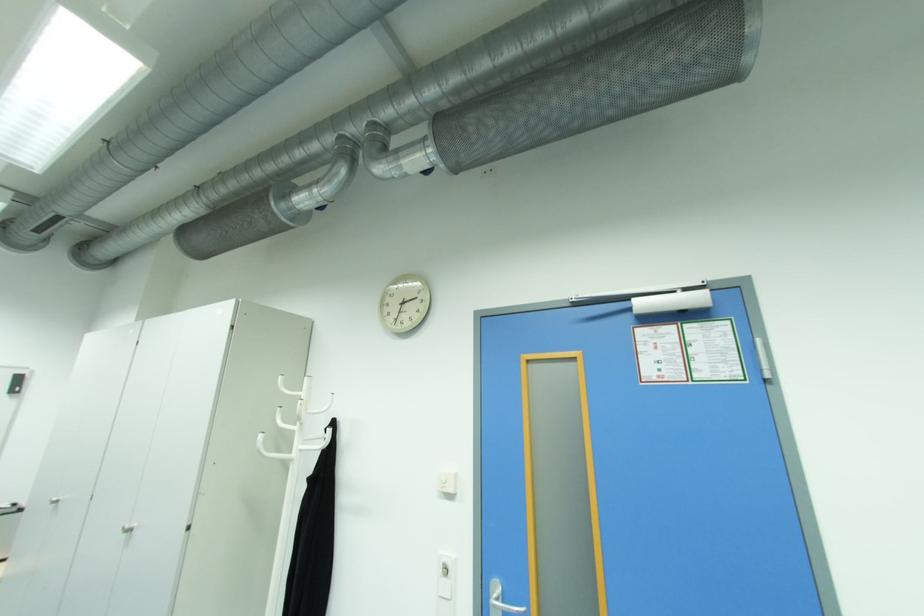
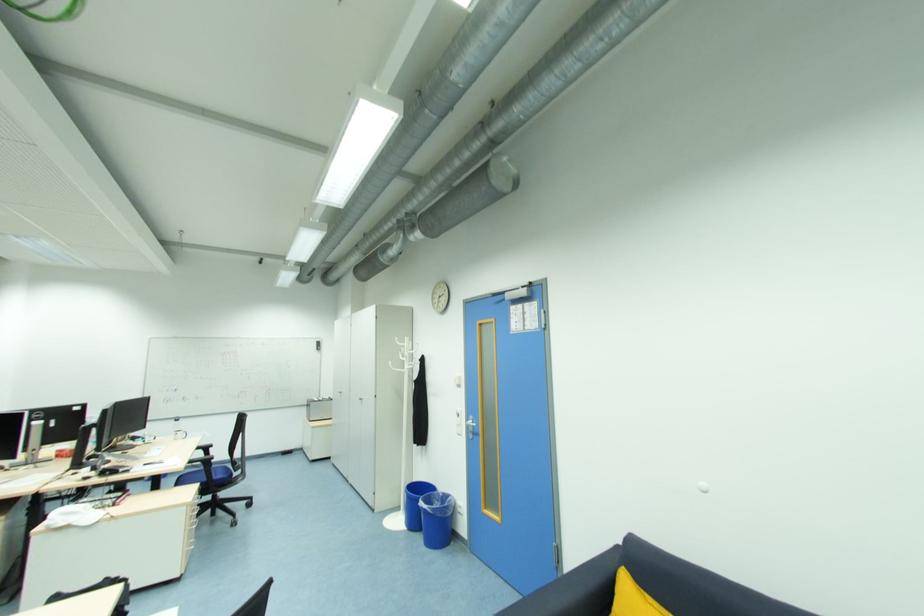
Find the pixel in the second image that matches pixel 131 533 in the first image.

(363, 400)